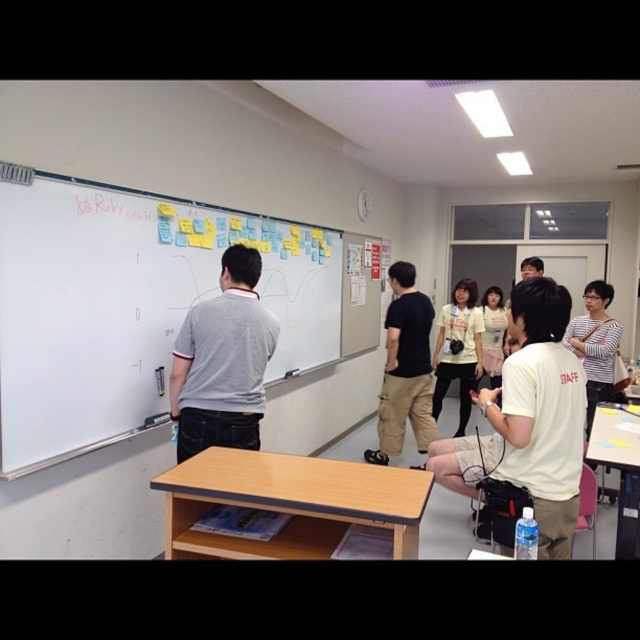
You are standing in the classroom and want to move from the point at coordinates point (x=506, y=410) to the point at coordinates point (x=230, y=291). Can you walk directly between them without any obstacles?

Point (x=506, y=410) is in front of point (x=230, y=291), so there might be an obstacle between them. You cannot walk directly between them without any obstacles.

From the picture: You are standing in the classroom and want to reach the point marked at coordinates (x=467, y=484). Can you estimate how far you need to walk to get there?

The distance of point (x=467, y=484) from the viewer is 2.69 meters, so you need to walk approximately 2.69 meters to reach that point.

In the classroom scene, there are two people at the center wearing cotton shirts. The white cotton shirt at center and the gray cotton shirt at center. Which one is positioned to the right?

The white cotton shirt at center is positioned to the right of the gray cotton shirt at center.